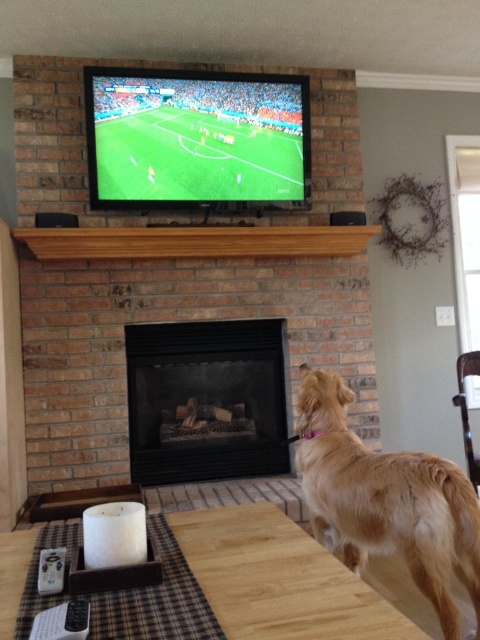
Question: In this image, where is smooth glossy screen at upper center located relative to black glass fireplace at center?

Choices:
 (A) left
 (B) right

Answer: (A)

Question: Which point is closer to the camera taking this photo?

Choices:
 (A) (244, 161)
 (B) (252, 438)
 (C) (69, 605)

Answer: (C)

Question: Among these objects, which one is farthest from the camera?

Choices:
 (A) black glass fireplace at center
 (B) black plastic remote at lower left
 (C) white plastic remote at lower left

Answer: (A)

Question: Does golden fur dog at lower right have a smaller size compared to white plastic remote at lower left?

Choices:
 (A) no
 (B) yes

Answer: (A)

Question: Which point is closer to the camera?

Choices:
 (A) (408, 512)
 (B) (141, 435)
 (C) (170, 108)
 (D) (47, 552)

Answer: (D)

Question: Is golden fur dog at lower right above black plastic remote at lower left?

Choices:
 (A) no
 (B) yes

Answer: (A)